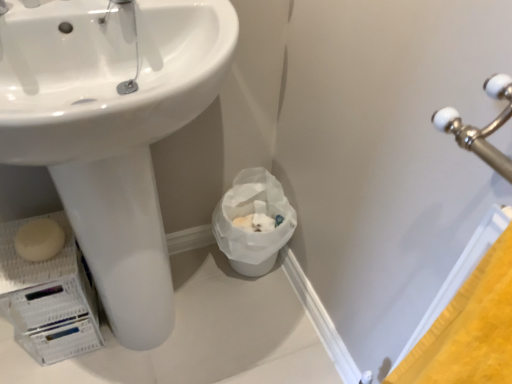
Question: Is white paper bag at lower center wider or thinner than white matte soap at lower left?

Choices:
 (A) thin
 (B) wide

Answer: (B)

Question: Relative to white matte soap at lower left, is white paper bag at lower center in front or behind?

Choices:
 (A) front
 (B) behind

Answer: (B)

Question: Which object is positioned farthest from the white paper bag at lower center?

Choices:
 (A) white matte soap at lower left
 (B) white glossy sink at center

Answer: (A)

Question: Which is nearer to the white matte soap at lower left?

Choices:
 (A) white glossy sink at center
 (B) white paper bag at lower center

Answer: (A)